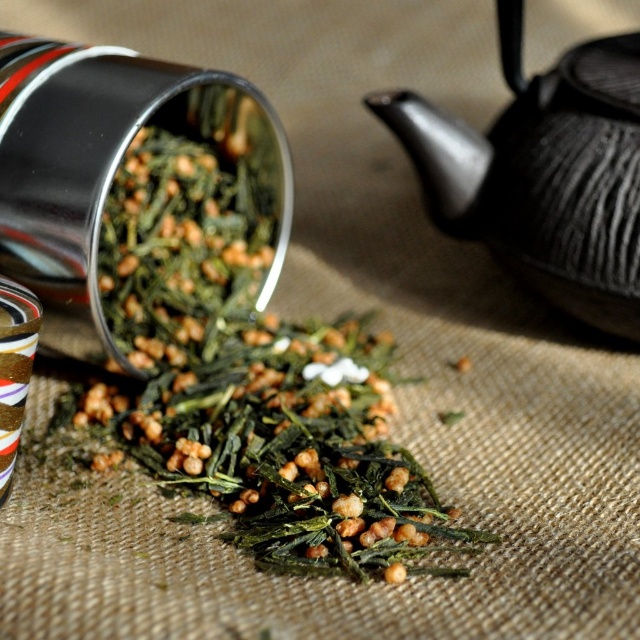
Where is `green leafy with small seeds at center`? The width and height of the screenshot is (640, 640). green leafy with small seeds at center is located at coordinates (252, 380).

Does green leafy with small seeds at center appear over black textured teapot at upper right?

Incorrect, green leafy with small seeds at center is not positioned above black textured teapot at upper right.

Where is `green leafy with small seeds at center`? Image resolution: width=640 pixels, height=640 pixels. green leafy with small seeds at center is located at coordinates (252, 380).